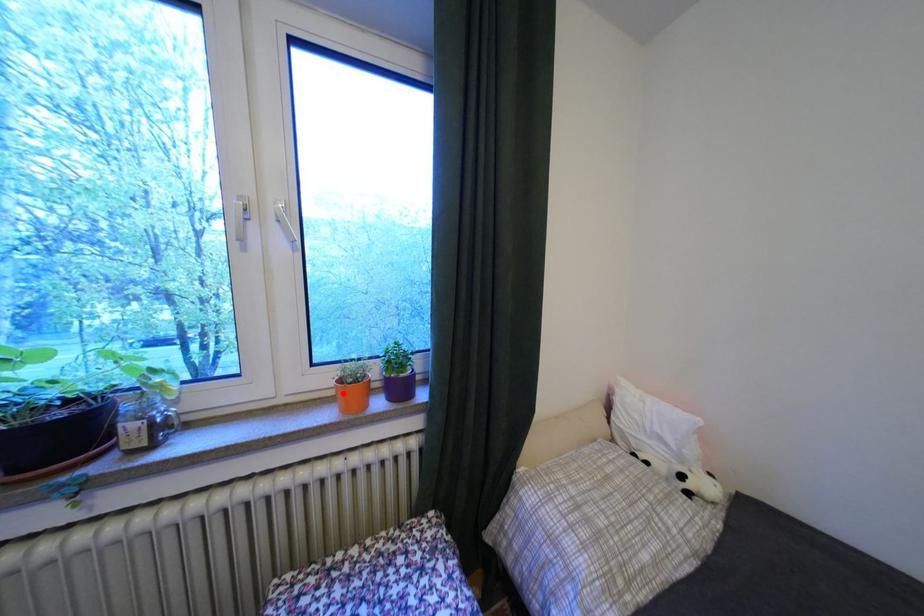
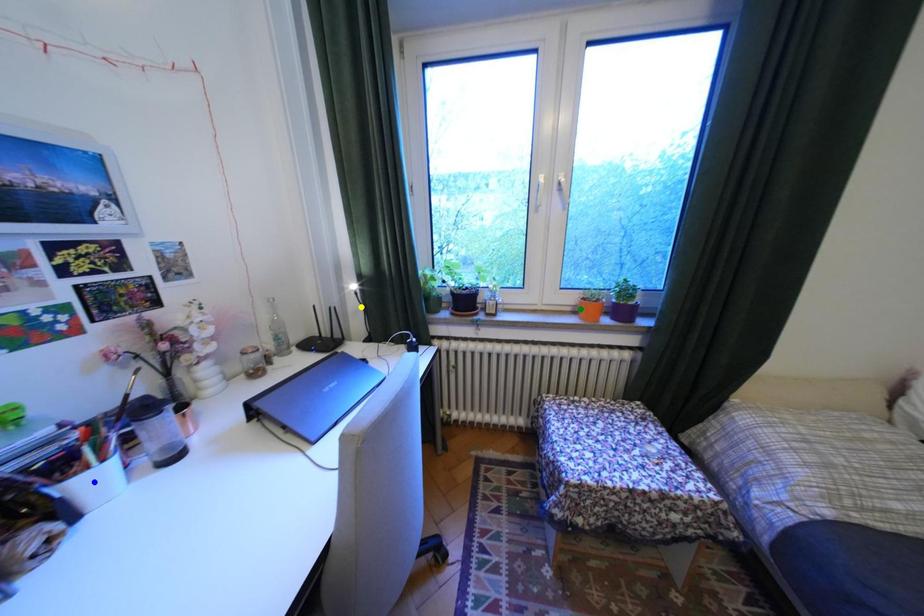
Question: I am providing you with two images of the same scene from different viewpoints. A red point is marked on the first image. You are given multiple points on the second image. Which spot in image 2 lines up with the point in image 1?

Choices:
 (A) yellow point
 (B) green point
 (C) blue point

Answer: (B)